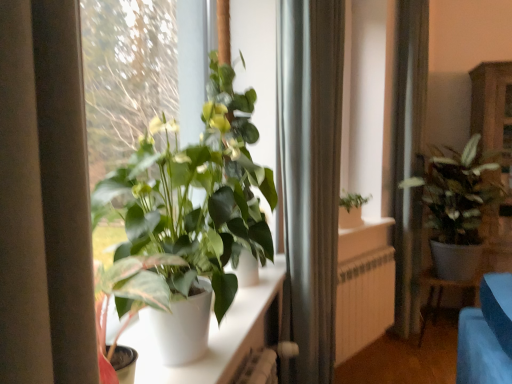
Question: Is green matte plant at center, the first houseplant in the front-to-back sequence, bigger or smaller than textured green plant at right, the first houseplant in the back-to-front sequence?

Choices:
 (A) big
 (B) small

Answer: (B)

Question: Is point (238, 226) closer or farther from the camera than point (471, 150)?

Choices:
 (A) farther
 (B) closer

Answer: (B)

Question: Considering the real-world distances, which object is farthest from the silky white curtain at right, marked as the second curtain in a front-to-back arrangement?

Choices:
 (A) green matte plant at center, the first houseplant in the front-to-back sequence
 (B) white matte radiator at center
 (C) white glossy plant at center
 (D) textured green plant at right, the first houseplant from the right
 (E) wooden cabinet at right

Answer: (A)

Question: Estimate the real-world distances between objects in this image. Which object is closer to the silky white curtain at right, marked as the first curtain in a back-to-front arrangement?

Choices:
 (A) textured green plant at right, the first houseplant from the right
 (B) white glossy plant at center
 (C) green matte plant at center, the first houseplant in the front-to-back sequence
 (D) wooden cabinet at right
 (E) white matte radiator at center

Answer: (A)